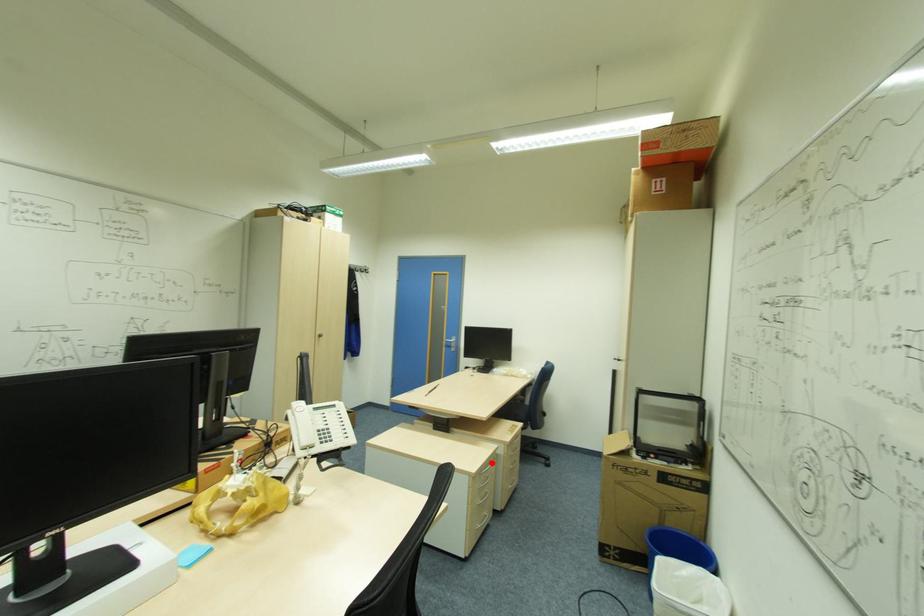
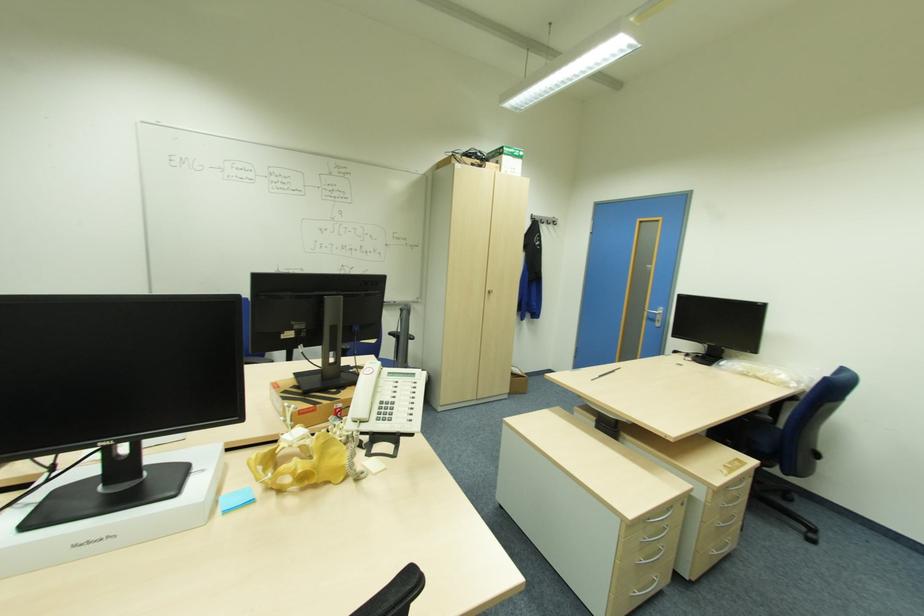
Find the pixel in the second image that matches the highlighted location in the first image.

(672, 511)